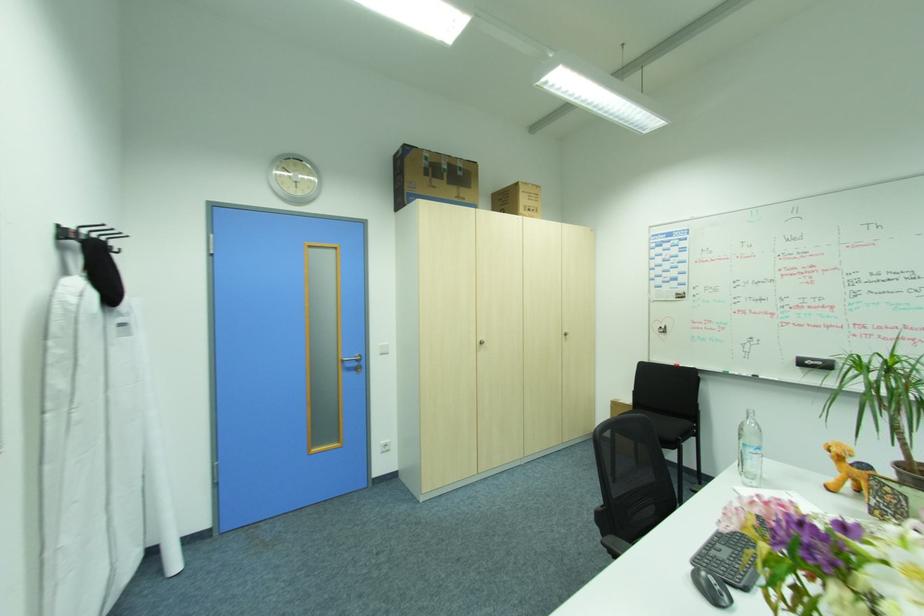
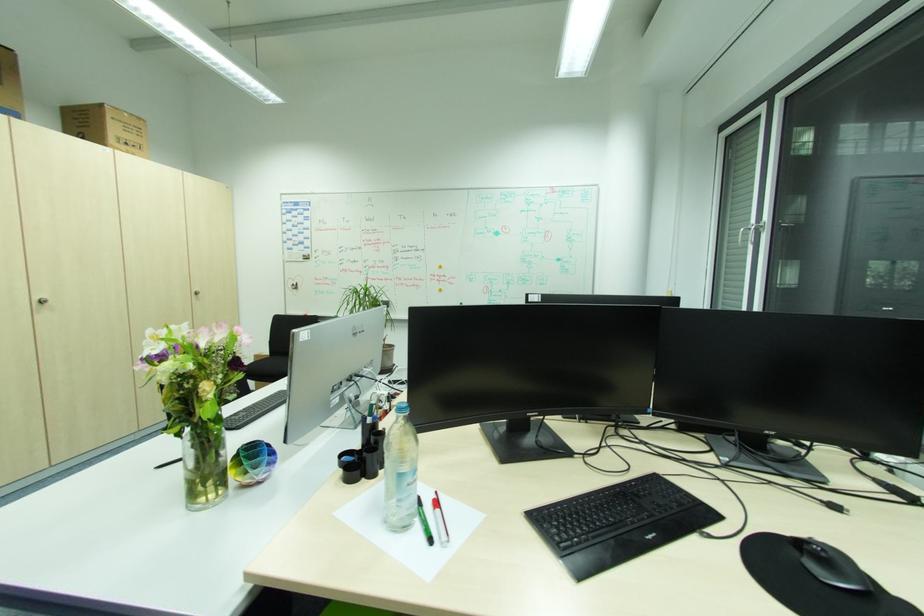
Locate, in the second image, the point that corresponds to point 487,342 in the first image.

(47, 302)